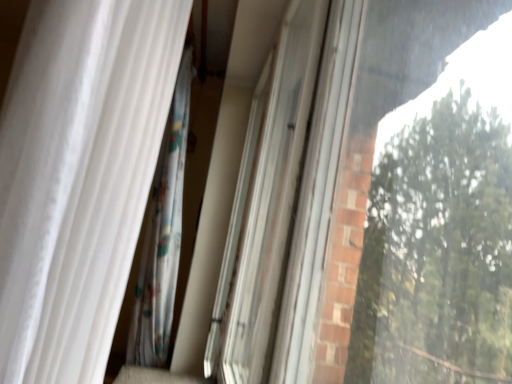
Question: Should I look upward or downward to see white glossy screen door at center?

Choices:
 (A) up
 (B) down

Answer: (B)

Question: Does white sheer curtain at left have a greater height compared to white glossy screen door at center?

Choices:
 (A) yes
 (B) no

Answer: (B)

Question: Considering the relative sizes of white sheer curtain at left and white glossy screen door at center in the image provided, is white sheer curtain at left shorter than white glossy screen door at center?

Choices:
 (A) yes
 (B) no

Answer: (A)

Question: Is white sheer curtain at left behind white glossy screen door at center?

Choices:
 (A) no
 (B) yes

Answer: (A)

Question: Does white sheer curtain at left turn towards white glossy screen door at center?

Choices:
 (A) no
 (B) yes

Answer: (A)

Question: Is white sheer curtain at left bigger than white glossy screen door at center?

Choices:
 (A) no
 (B) yes

Answer: (B)

Question: Is white sheer curtain at left smaller than white glossy screen door at center?

Choices:
 (A) yes
 (B) no

Answer: (B)

Question: Does white glossy screen door at center have a lesser width compared to white sheer curtain at left?

Choices:
 (A) yes
 (B) no

Answer: (A)

Question: Does white glossy screen door at center lie behind white sheer curtain at left?

Choices:
 (A) yes
 (B) no

Answer: (A)

Question: From a real-world perspective, is white glossy screen door at center under white sheer curtain at left?

Choices:
 (A) yes
 (B) no

Answer: (A)

Question: Is white glossy screen door at center positioned with its back to white sheer curtain at left?

Choices:
 (A) yes
 (B) no

Answer: (B)

Question: Is white glossy screen door at center to the right of white sheer curtain at left from the viewer's perspective?

Choices:
 (A) no
 (B) yes

Answer: (B)

Question: Considering the relative sizes of white glossy screen door at center and white sheer curtain at left in the image provided, is white glossy screen door at center smaller than white sheer curtain at left?

Choices:
 (A) no
 (B) yes

Answer: (B)

Question: From a real-world perspective, is white glossy screen door at center above or below white sheer curtain at left?

Choices:
 (A) above
 (B) below

Answer: (B)